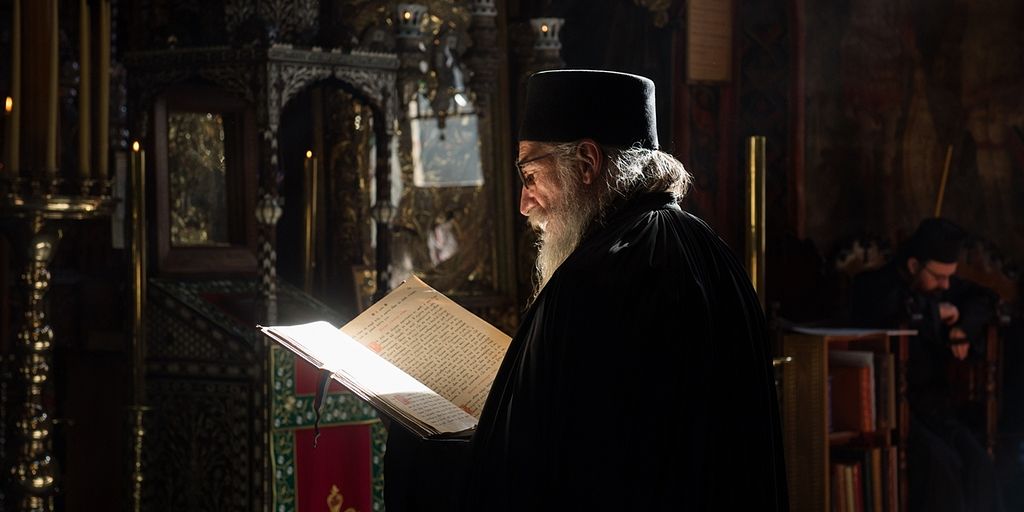
Where is `book`? The height and width of the screenshot is (512, 1024). book is located at coordinates (424, 393).